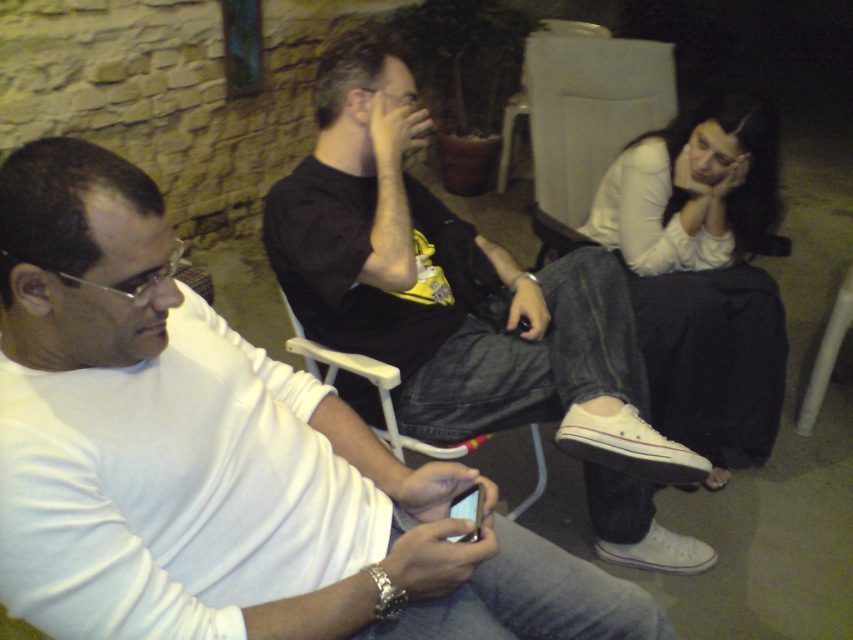
You are a photographer standing in front of the scene. You want to take a photo of the black matte shirt at center and the matte black smartphone at lower center. Which object should you focus on first if you want to ensure both are in sharp focus?

The black matte shirt at center is much taller than the matte black smartphone at lower center, so focusing on the black matte shirt at center first will help ensure both are in sharp focus.

You are a photographer trying to capture a candid shot of the scene. You notice the white matte shirt at lower right and the matte black smartphone at lower center. Which object should you focus on first if you want to ensure both are in the frame without moving the camera?

The white matte shirt at lower right is much taller than the matte black smartphone at lower center. To ensure both are in the frame, focus on the taller object first, which is the white matte shirt at lower right, then adjust the camera angle to include the smaller matte black smartphone at lower center.